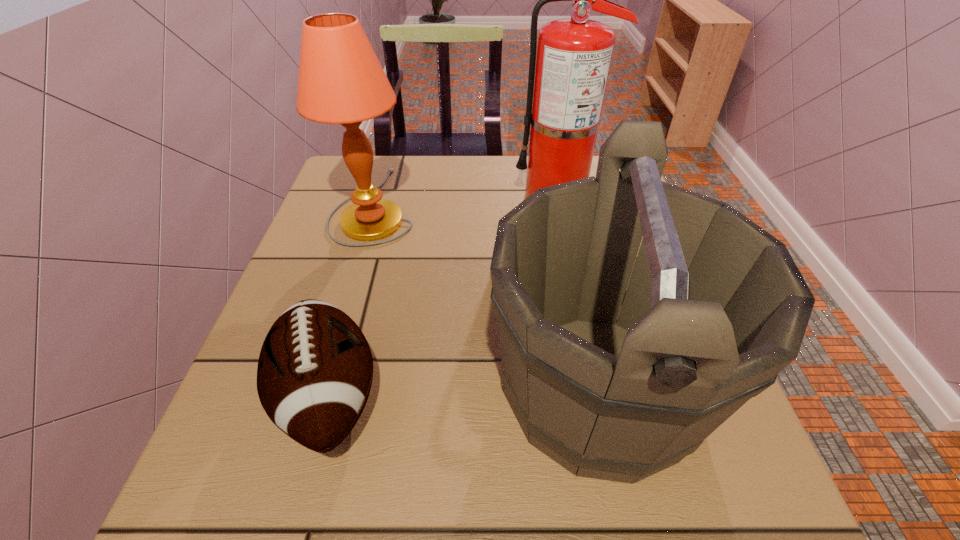
Where is `fire extinguisher`? The image size is (960, 540). fire extinguisher is located at coordinates (573, 60).

Where is `lamp`? Image resolution: width=960 pixels, height=540 pixels. lamp is located at coordinates (341, 81).

In order to click on bucket in this screenshot , I will do `click(715, 308)`.

The height and width of the screenshot is (540, 960). What are the coordinates of `the shortest object` in the screenshot? It's located at (315, 369).

This screenshot has height=540, width=960. I want to click on vacant space located at the nozzle of the fire extinguisher, so click(x=398, y=197).

This screenshot has height=540, width=960. Find the location of `free space located at the nozzle of the fire extinguisher`. free space located at the nozzle of the fire extinguisher is located at coordinates (355, 197).

Where is `vacant space located at the nozzle of the fire extinguisher`? The width and height of the screenshot is (960, 540). vacant space located at the nozzle of the fire extinguisher is located at coordinates (450, 197).

The height and width of the screenshot is (540, 960). Find the location of `blank space located 0.350m on the front of the lamp`. blank space located 0.350m on the front of the lamp is located at coordinates (322, 387).

Locate an element on the screen. The image size is (960, 540). vacant space located on the back of the bucket is located at coordinates (570, 259).

I want to click on vacant space situated 0.240m on the back of the football (American), so click(370, 249).